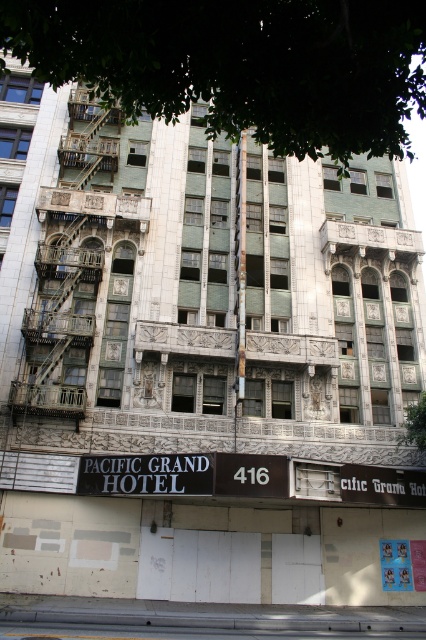
Describe the element at coordinates (239, 65) in the screenshot. Image resolution: width=426 pixels, height=640 pixels. I see `green leafy tree at upper center` at that location.

Can you confirm if green leafy tree at upper center is bigger than black matte sign at lower right?

Correct, green leafy tree at upper center is larger in size than black matte sign at lower right.

Does point (89, 83) come closer to viewer compared to point (382, 492)?

Yes, it is.

The height and width of the screenshot is (640, 426). Identify the location of green leafy tree at upper center. (239, 65).

Can you confirm if green leafy tree at upper center is wider than black metal sign at center?

Indeed, green leafy tree at upper center has a greater width compared to black metal sign at center.

Identify the location of green leafy tree at upper center. The width and height of the screenshot is (426, 640). (239, 65).

Who is more distant from viewer, [94,465] or [414,481]?

The point [414,481] is behind.

Is point (112, 465) in front of point (363, 488)?

No, it is behind (363, 488).

Find the location of a particular element. This screenshot has width=426, height=640. black metal sign at center is located at coordinates (146, 474).